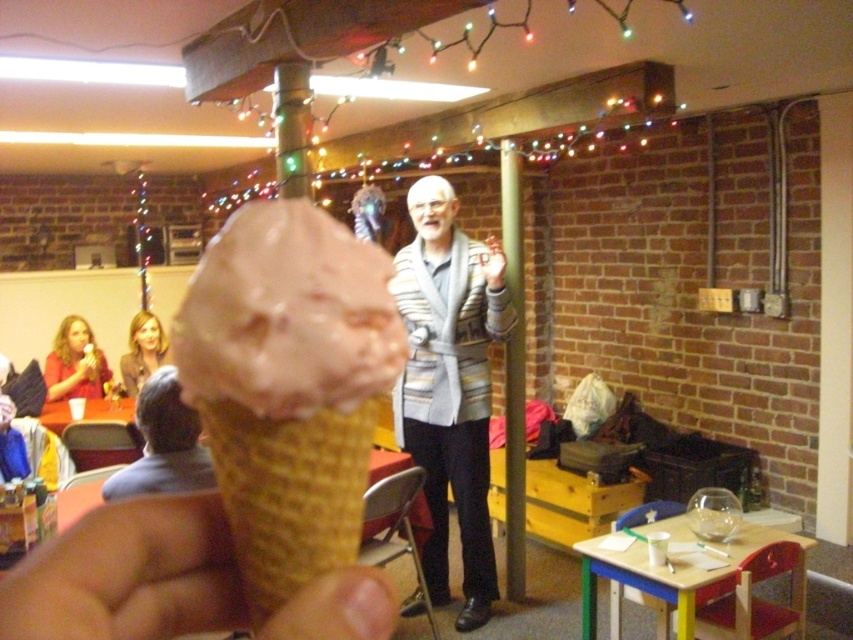
Question: Can you confirm if striped sweater at center is positioned to the left of matte pink shirt at lower left?

Choices:
 (A) no
 (B) yes

Answer: (A)

Question: Is light brown waffle cone at center to the left of brown hair at left from the viewer's perspective?

Choices:
 (A) yes
 (B) no

Answer: (B)

Question: Which point is farther to the camera?

Choices:
 (A) (78, 365)
 (B) (161, 396)

Answer: (A)

Question: Considering the real-world distances, which object is farthest from the blonde hair at upper left?

Choices:
 (A) striped sweater at center
 (B) smooth beige cone at lower left
 (C) matte pink shirt at lower left

Answer: (B)

Question: Which of the following is the closest to the observer?

Choices:
 (A) (389, 614)
 (B) (141, 458)
 (C) (323, 346)
 (D) (68, 316)

Answer: (A)

Question: Is brown hair at left to the left of matte pink shirt at lower left from the viewer's perspective?

Choices:
 (A) yes
 (B) no

Answer: (B)